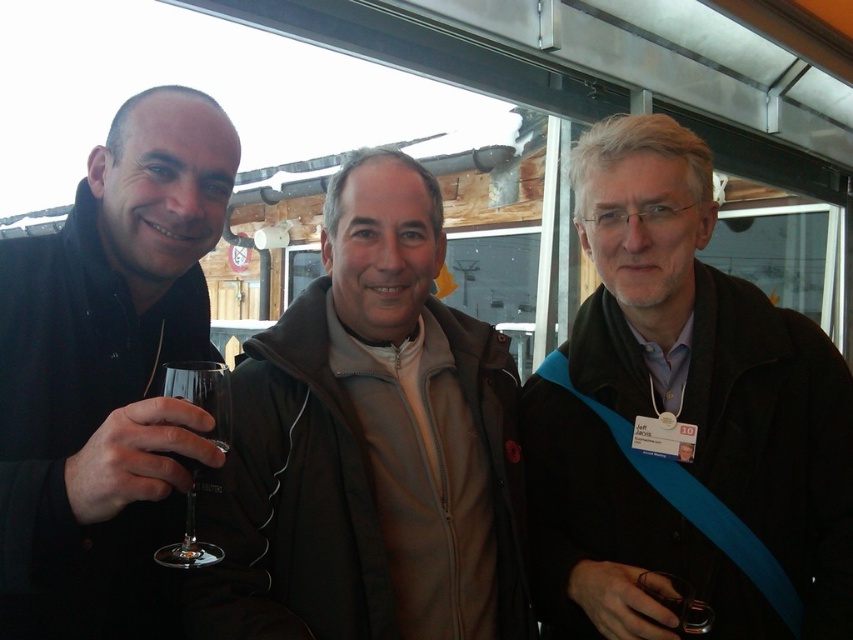
Find the location of a particular element. matte black jacket at right is located at coordinates (682, 422).

Who is positioned more to the left, matte black jacket at right or matte black jacket at left?

matte black jacket at left

Where is `matte black jacket at right`? The image size is (853, 640). matte black jacket at right is located at coordinates (682, 422).

Identify the location of matte black jacket at right. (682, 422).

Is matte black jacket at right thinner than transparent glass at left?

No.

Does point (582, 625) come farther from viewer compared to point (212, 550)?

Yes, it is behind point (212, 550).

The image size is (853, 640). In order to click on matte black jacket at right in this screenshot , I will do `click(682, 422)`.

Between khaki zip-up jacket at center and transparent glass at left, which one appears on the right side from the viewer's perspective?

From the viewer's perspective, khaki zip-up jacket at center appears more on the right side.

Between khaki zip-up jacket at center and transparent glass at left, which one appears on the left side from the viewer's perspective?

Positioned to the left is transparent glass at left.

Between point (459, 481) and point (164, 394), which one is positioned behind?

Point (459, 481)

This screenshot has height=640, width=853. In order to click on khaki zip-up jacket at center in this screenshot , I will do `click(370, 444)`.